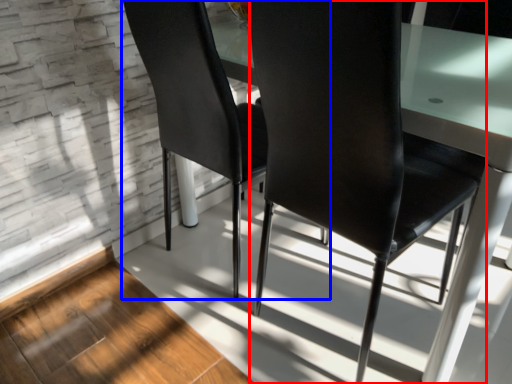
Question: Among these objects, which one is farthest to the camera, chair (highlighted by a red box) or chair (highlighted by a blue box)?

Choices:
 (A) chair
 (B) chair

Answer: (B)